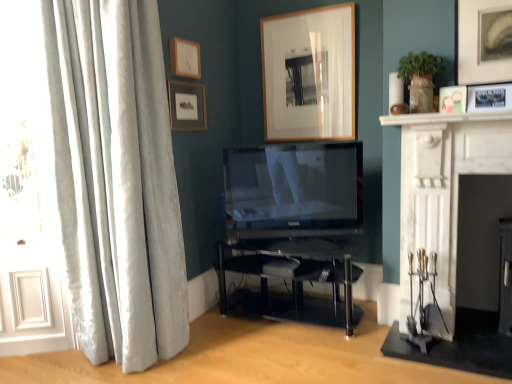
Question: Does silky white curtains at left have a lesser height compared to matte black tv at center?

Choices:
 (A) no
 (B) yes

Answer: (A)

Question: Considering the relative sizes of silky white curtains at left and matte black tv at center in the image provided, is silky white curtains at left thinner than matte black tv at center?

Choices:
 (A) yes
 (B) no

Answer: (B)

Question: Is silky white curtains at left surrounding matte black tv at center?

Choices:
 (A) yes
 (B) no

Answer: (B)

Question: Is silky white curtains at left behind matte black tv at center?

Choices:
 (A) yes
 (B) no

Answer: (B)

Question: Considering the relative sizes of silky white curtains at left and matte black tv at center in the image provided, is silky white curtains at left smaller than matte black tv at center?

Choices:
 (A) no
 (B) yes

Answer: (A)

Question: From a real-world perspective, is silky white curtains at left on top of matte black tv at center?

Choices:
 (A) no
 (B) yes

Answer: (B)

Question: Does silky white curtains at left have a lesser width compared to white marble fireplace at right?

Choices:
 (A) yes
 (B) no

Answer: (A)

Question: Can you confirm if silky white curtains at left is bigger than white marble fireplace at right?

Choices:
 (A) yes
 (B) no

Answer: (A)

Question: Considering the relative positions of silky white curtains at left and white marble fireplace at right in the image provided, is silky white curtains at left behind white marble fireplace at right?

Choices:
 (A) yes
 (B) no

Answer: (A)

Question: From the image's perspective, is silky white curtains at left located above white marble fireplace at right?

Choices:
 (A) no
 (B) yes

Answer: (B)

Question: Can you confirm if silky white curtains at left is positioned to the right of white marble fireplace at right?

Choices:
 (A) yes
 (B) no

Answer: (B)

Question: Is silky white curtains at left at the left side of white marble fireplace at right?

Choices:
 (A) yes
 (B) no

Answer: (A)

Question: From a real-world perspective, is matte wood picture frame at upper center, arranged as the 4th picture frame when viewed from the right, on top of wooden picture frame at upper center, which ranks as the third picture frame in left-to-right order?

Choices:
 (A) no
 (B) yes

Answer: (B)